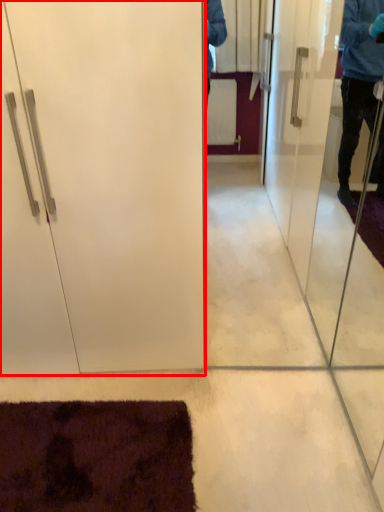
Question: From the image's perspective, where is door (annotated by the red box) located in relation to screen door in the image?

Choices:
 (A) above
 (B) below

Answer: (A)